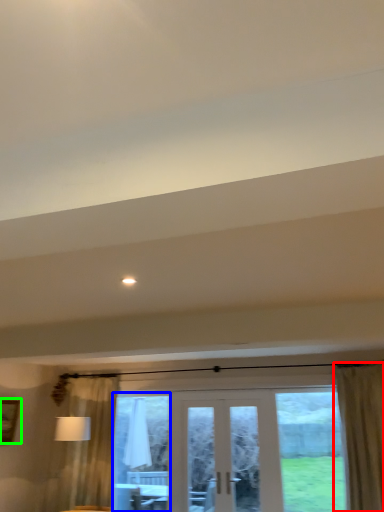
Question: Based on their relative distances, which object is farther from curtain (highlighted by a red box)? Choose from window screen (highlighted by a blue box) and picture frame (highlighted by a green box).

Choices:
 (A) window screen
 (B) picture frame

Answer: (B)